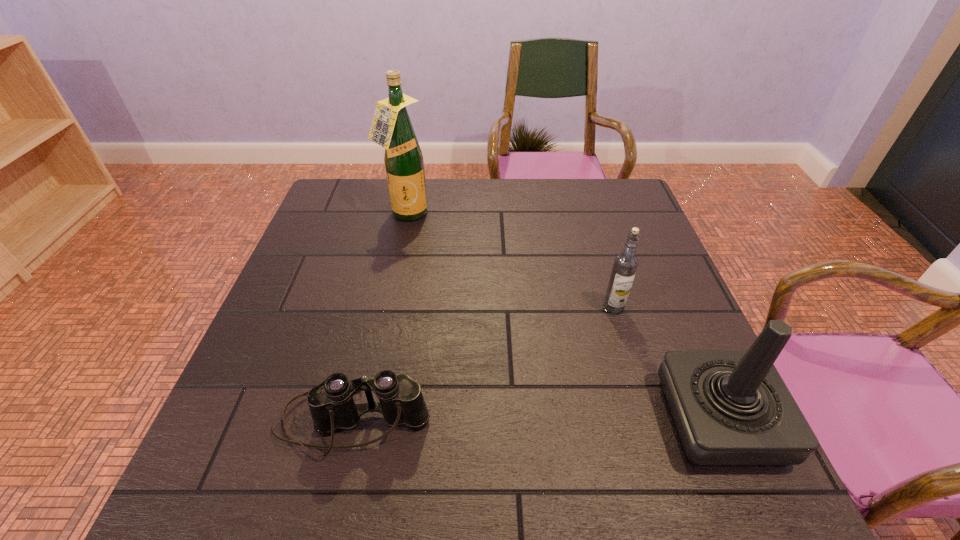
The height and width of the screenshot is (540, 960). Find the location of `object that is at the near right corner`. object that is at the near right corner is located at coordinates click(x=730, y=408).

Identify the location of blank area at the far edge. (524, 194).

This screenshot has height=540, width=960. I want to click on vacant space at the near edge of the desktop, so click(649, 408).

Where is `free space at the left edge`? The width and height of the screenshot is (960, 540). free space at the left edge is located at coordinates (301, 285).

In the image, there is a desktop. Where is `vacant space at the right edge`? Image resolution: width=960 pixels, height=540 pixels. vacant space at the right edge is located at coordinates (688, 348).

In the image, there is a desktop. Identify the location of free space at the far left corner. click(x=360, y=199).

At what (x,y) coordinates should I click in order to perform the action: click on free space at the near left corner. Please return your answer as a coordinate pair (x, y). This screenshot has width=960, height=540. Looking at the image, I should click on (261, 399).

What are the coordinates of `free point at the far right corner` in the screenshot? It's located at (612, 210).

I want to click on unoccupied area between the farthest object and the third tallest object, so click(x=510, y=261).

Image resolution: width=960 pixels, height=540 pixels. I want to click on blank region between the liquor and the shortest object, so click(379, 318).